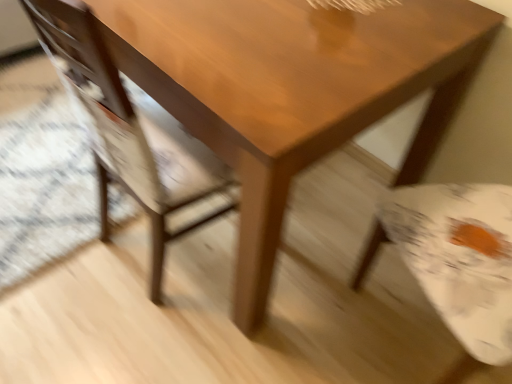
Question: Does matte wood chair at center come in front of glossy wood table at center?

Choices:
 (A) no
 (B) yes

Answer: (B)

Question: Can you confirm if matte wood chair at center is smaller than glossy wood table at center?

Choices:
 (A) no
 (B) yes

Answer: (B)

Question: Is matte wood chair at center taller than glossy wood table at center?

Choices:
 (A) yes
 (B) no

Answer: (A)

Question: Can you confirm if matte wood chair at center is shorter than glossy wood table at center?

Choices:
 (A) no
 (B) yes

Answer: (A)

Question: Is matte wood chair at center to the right of glossy wood table at center from the viewer's perspective?

Choices:
 (A) no
 (B) yes

Answer: (A)

Question: From a real-world perspective, is matte wood chair at center positioned over glossy wood table at center based on gravity?

Choices:
 (A) no
 (B) yes

Answer: (B)

Question: Can you confirm if glossy wood table at center is thinner than matte wood chair at center?

Choices:
 (A) no
 (B) yes

Answer: (A)

Question: Is glossy wood table at center not within matte wood chair at center?

Choices:
 (A) no
 (B) yes

Answer: (B)

Question: Is glossy wood table at center smaller than matte wood chair at center?

Choices:
 (A) yes
 (B) no

Answer: (B)

Question: Can you confirm if glossy wood table at center is positioned to the right of matte wood chair at center?

Choices:
 (A) no
 (B) yes

Answer: (B)

Question: Can matte wood chair at center be found inside glossy wood table at center?

Choices:
 (A) yes
 (B) no

Answer: (A)

Question: Considering the relative sizes of glossy wood table at center and matte wood chair at center in the image provided, is glossy wood table at center bigger than matte wood chair at center?

Choices:
 (A) no
 (B) yes

Answer: (B)

Question: From a real-world perspective, is glossy wood table at center above or below matte wood chair at center?

Choices:
 (A) below
 (B) above

Answer: (A)